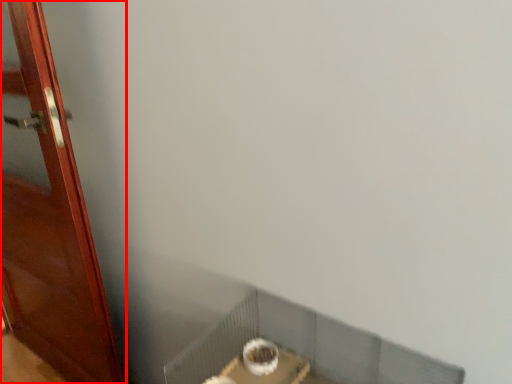
Question: From the image, what is the correct spatial relationship of door (annotated by the red box) in relation to window sill?

Choices:
 (A) right
 (B) left

Answer: (B)